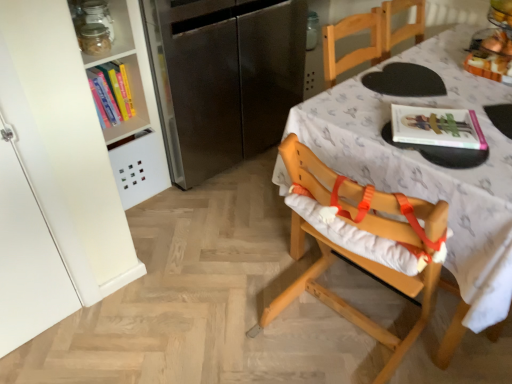
Measure the distance between point (124, 68) and camera.

The depth of point (124, 68) is 1.92 meters.

Image resolution: width=512 pixels, height=384 pixels. Describe the element at coordinates (359, 255) in the screenshot. I see `wooden highchair at center` at that location.

The width and height of the screenshot is (512, 384). What do you see at coordinates (430, 172) in the screenshot?
I see `wooden table at center` at bounding box center [430, 172].

In order to face translucent glass bowl at upper right, should I rotate leftwards or rightwards?

You should look right and rotate roughly 31.958 degrees.

What is the approximate width of clear glass jar at upper left?

clear glass jar at upper left is 5.68 inches in width.

Identify the location of hardcover book at upper left. (111, 93).

Find the location of a particular element. table below the hardcover book at upper left (from the image's perspective) is located at coordinates (430, 172).

Is hardcover book at upper left aimed at wooden table at center?

No, hardcover book at upper left is not facing towards wooden table at center.

Does hardcover book at upper left have a lesser height compared to wooden table at center?

Yes, hardcover book at upper left is shorter than wooden table at center.

Measure the distance from hardcover book at upper left to wooden table at center.

hardcover book at upper left is 1.17 meters away from wooden table at center.

Which is nearer, (117,5) or (111,102)?

The point (117,5) is in front.

Does clear glass jar at upper left appear on the left side of hardcover book at upper left?

In fact, clear glass jar at upper left is to the right of hardcover book at upper left.

Based on their sizes in the image, would you say clear glass jar at upper left is bigger or smaller than hardcover book at upper left?

Clearly, clear glass jar at upper left is smaller in size than hardcover book at upper left.

From a real-world perspective, does clear glass jar at upper left stand above hardcover book at upper left?

Yes, from a real-world perspective, clear glass jar at upper left is on top of hardcover book at upper left.

Which object is positioned more to the right, wooden table at center or clear glass jar at upper left?

wooden table at center is more to the right.

Is point (470, 282) closer to viewer compared to point (128, 33)?

Yes, point (470, 282) is in front of point (128, 33).

Would you say wooden table at center is a long distance from clear glass jar at upper left?

Yes.

What's the angular difference between wooden table at center and clear glass jar at upper left's facing directions?

There is a 89.8-degree angle between the facing directions of wooden table at center and clear glass jar at upper left.

Considering the sizes of objects wooden table at center and wooden highchair at center in the image provided, who is smaller, wooden table at center or wooden highchair at center?

wooden highchair at center.

From a real-world perspective, is wooden table at center positioned under wooden highchair at center based on gravity?

Yes, from a real-world perspective, wooden table at center is under wooden highchair at center.

Does point (506, 306) come in front of point (380, 380)?

Yes, point (506, 306) is in front of point (380, 380).

Is wooden table at center inside or outside of wooden highchair at center?

wooden table at center is located beyond the bounds of wooden highchair at center.

Is stainless steel refrigerator at left next to wooden table at center and touching it?

stainless steel refrigerator at left and wooden table at center are not in contact.

Does stainless steel refrigerator at left turn towards wooden table at center?

Yes, stainless steel refrigerator at left faces towards wooden table at center.

Consider the image. Between stainless steel refrigerator at left and wooden table at center, which one has smaller size?

Smaller between the two is stainless steel refrigerator at left.

Image resolution: width=512 pixels, height=384 pixels. Find the location of `table to the right of stainless steel refrigerator at left`. table to the right of stainless steel refrigerator at left is located at coordinates click(430, 172).

Does wooden table at center contain matte pink magazine at upper right?

Yes.

Is wooden table at center far away from matte pink magazine at upper right?

wooden table at center is near matte pink magazine at upper right, not far away.

Which of these two, wooden table at center or matte pink magazine at upper right, is bigger?

wooden table at center.

Who is taller, wooden table at center or matte pink magazine at upper right?

wooden table at center.

Is translucent glass bowl at upper right not within matte pink magazine at upper right?

Yes, translucent glass bowl at upper right is not within matte pink magazine at upper right.

Does translucent glass bowl at upper right touch matte pink magazine at upper right?

No, translucent glass bowl at upper right is not in contact with matte pink magazine at upper right.

What's the angular difference between translucent glass bowl at upper right and matte pink magazine at upper right's facing directions?

The facing directions of translucent glass bowl at upper right and matte pink magazine at upper right are 32.5 degrees apart.

Is translucent glass bowl at upper right turned away from matte pink magazine at upper right?

translucent glass bowl at upper right does not have its back to matte pink magazine at upper right.

This screenshot has width=512, height=384. What are the coordinates of `book above the wooden table at center (from a real-world perspective)` in the screenshot? It's located at (111, 93).

Identify the location of book that appears below the clear glass jar at upper left (from a real-world perspective). (111, 93).

Based on their spatial positions, is clear glass jar at upper left or hardcover book at upper left further from stainless steel refrigerator at left?

clear glass jar at upper left is further to stainless steel refrigerator at left.

Looking at this image, when comparing their distances from matte pink magazine at upper right, does wooden table at center or translucent glass bowl at upper right seem further?

Based on the image, translucent glass bowl at upper right appears to be further to matte pink magazine at upper right.

Estimate the real-world distances between objects in this image. Which object is further from wooden table at center, wooden highchair at center or clear glass jar at upper left?

clear glass jar at upper left.

Looking at the image, which one is located closer to matte pink magazine at upper right, stainless steel refrigerator at left or translucent glass bowl at upper right?

translucent glass bowl at upper right.

Considering their positions, is wooden highchair at center positioned further to stainless steel refrigerator at left than hardcover book at upper left?

Among the two, wooden highchair at center is located further to stainless steel refrigerator at left.

Looking at the image, which one is located closer to wooden table at center, translucent glass bowl at upper right or hardcover book at upper left?

Among the two, translucent glass bowl at upper right is located nearer to wooden table at center.

Looking at the image, which one is located closer to hardcover book at upper left, translucent glass bowl at upper right or wooden table at center?

wooden table at center.

Considering their positions, is wooden table at center positioned closer to wooden highchair at center than stainless steel refrigerator at left?

Among the two, wooden table at center is located nearer to wooden highchair at center.

Locate an element on the screen. Image resolution: width=512 pixels, height=384 pixels. chair located between clear glass jar at upper left and wooden table at center in the left-right direction is located at coordinates (359, 255).

At what (x,y) coordinates should I click in order to perform the action: click on magazine situated between wooden highchair at center and wooden table at center from left to right. Please return your answer as a coordinate pair (x, y). This screenshot has width=512, height=384. Looking at the image, I should click on (437, 127).

Find the location of a particular element. The image size is (512, 384). appliance between clear glass jar at upper left and matte pink magazine at upper right in the horizontal direction is located at coordinates (223, 78).

Find the location of `chair situated between clear glass jar at upper left and matte pink magazine at upper right from left to right`. chair situated between clear glass jar at upper left and matte pink magazine at upper right from left to right is located at coordinates (359, 255).